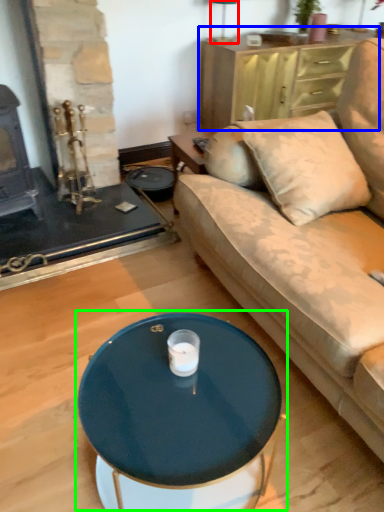
Question: Which object is the closest to the lamp (highlighted by a red box)? Choose among these: dresser (highlighted by a blue box) or coffee table (highlighted by a green box).

Choices:
 (A) dresser
 (B) coffee table

Answer: (A)